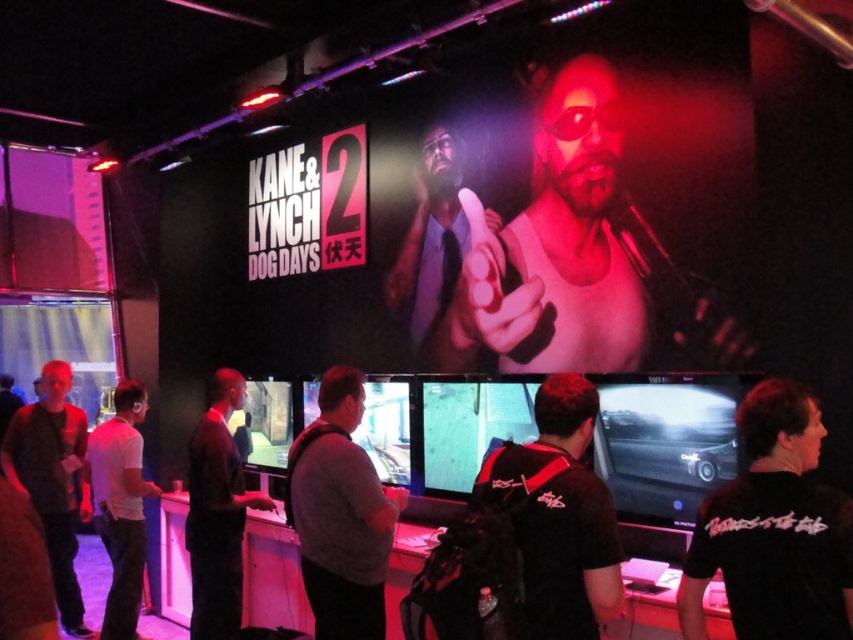
You are a photographer at the gaming convention and want to take a photo of the dark gray sweater at left and the white matte shirt at center. To ensure both are in the frame, should you position yourself to the left or right of the two people?

You should position yourself to the right of the two people because the dark gray sweater at left is to the left of white matte shirt at center, so positioning yourself to the right will allow both to be captured in the frame.

You are a photographer standing at the back of the gaming setup. You need to take a photo of the gray fabric shirt at center and the matte black tie at upper center. The camera you are using has a minimum focus distance of 1 meter. Will you be able to capture both subjects clearly in the same frame without moving closer?

The gray fabric shirt at center is 1.32 meters away from the matte black tie at upper center. Since the camera requires a minimum focus distance of 1 meter, the photographer can capture both subjects clearly as the distance between them is greater than the required focus distance.

You are standing in the gaming setup area and want to find the gray fabric shirt at center. Based on the coordinates provided, where should you look relative to the screen?

The gray fabric shirt at center is located at coordinates point (x=340, y=515), which is 80.5 percent from the left edge and 40 percent from the top edge of the screen.